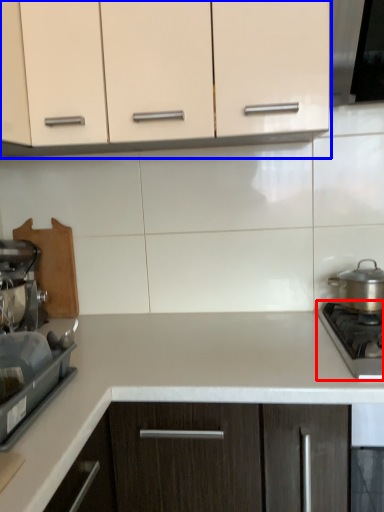
Question: Which object appears farthest to the camera in this image, gas stove (highlighted by a red box) or cabinetry (highlighted by a blue box)?

Choices:
 (A) gas stove
 (B) cabinetry

Answer: (B)